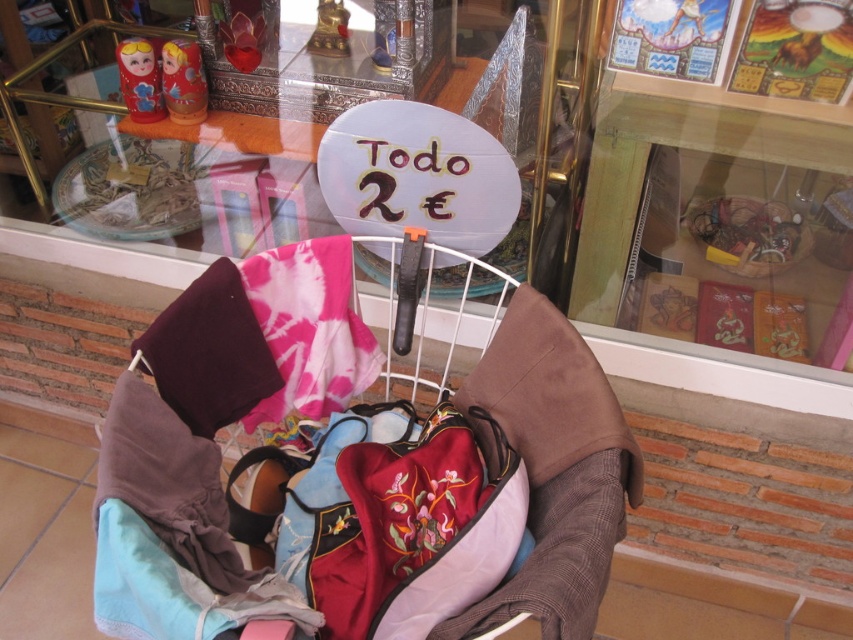
Does pink tie-dye fabric at center lie in front of matte plastic doll at upper left?

Yes.

Who is more forward, (277, 273) or (155, 113)?

Point (277, 273) is in front.

This screenshot has width=853, height=640. Find the location of `pink tie-dye fabric at center`. pink tie-dye fabric at center is located at coordinates tap(309, 326).

Who is lower down, velvet-like fabric baby carriage at center or matte plastic doll at upper left?

velvet-like fabric baby carriage at center

From the picture: Which is more to the left, velvet-like fabric baby carriage at center or matte plastic doll at upper left?

From the viewer's perspective, matte plastic doll at upper left appears more on the left side.

In order to click on velvet-like fabric baby carriage at center in this screenshot , I will do `click(225, 400)`.

Find the location of a particular element. velvet-like fabric baby carriage at center is located at coordinates (225, 400).

Which is below, matte plastic dolls at upper left or matte plastic doll at upper left?

matte plastic dolls at upper left is lower down.

Is matte plastic dolls at upper left shorter than matte plastic doll at upper left?

Yes, matte plastic dolls at upper left is shorter than matte plastic doll at upper left.

Between point (175, 120) and point (136, 93), which one is positioned in front?

Positioned in front is point (136, 93).

Locate an element on the screen. matte plastic dolls at upper left is located at coordinates (183, 81).